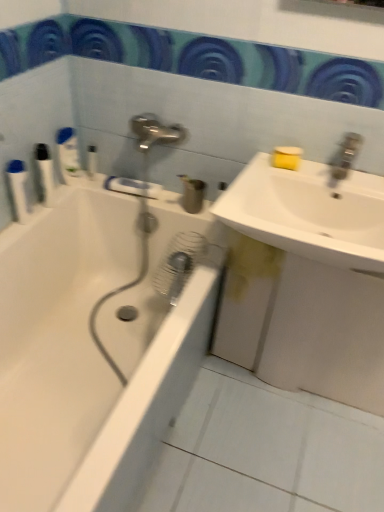
Question: Should I look upward or downward to see white glossy sink at upper right, placed as the first sink when sorted from top to bottom?

Choices:
 (A) up
 (B) down

Answer: (A)

Question: Is white plastic bottle at upper left, acting as the 3th toiletry starting from the right, aimed at white glossy bathtub at left?

Choices:
 (A) yes
 (B) no

Answer: (B)

Question: From a real-world perspective, is white plastic bottle at upper left, acting as the 3th toiletry starting from the right, on top of white glossy bathtub at left?

Choices:
 (A) yes
 (B) no

Answer: (A)

Question: Can you confirm if white plastic bottle at upper left, the third toiletry when ordered from left to right, is wider than white glossy bathtub at left?

Choices:
 (A) yes
 (B) no

Answer: (B)

Question: Is white plastic bottle at upper left, the third toiletry when ordered from left to right, completely or partially outside of white glossy bathtub at left?

Choices:
 (A) yes
 (B) no

Answer: (A)

Question: From the image's perspective, is white plastic bottle at upper left, acting as the 3th toiletry starting from the right, located above white glossy bathtub at left?

Choices:
 (A) yes
 (B) no

Answer: (A)

Question: Does white plastic bottle at upper left, acting as the 3th toiletry starting from the right, have a larger size compared to white glossy bathtub at left?

Choices:
 (A) yes
 (B) no

Answer: (B)

Question: Considering the relative sizes of white ceramic tile at lower center and white plastic bottle at upper left, acting as the 3th toiletry starting from the right, in the image provided, is white ceramic tile at lower center shorter than white plastic bottle at upper left, acting as the 3th toiletry starting from the right,?

Choices:
 (A) yes
 (B) no

Answer: (A)

Question: Is white ceramic tile at lower center at the right side of white plastic bottle at upper left, the third toiletry when ordered from left to right?

Choices:
 (A) no
 (B) yes

Answer: (B)

Question: From a real-world perspective, does white ceramic tile at lower center sit lower than white plastic bottle at upper left, the third toiletry when ordered from left to right?

Choices:
 (A) yes
 (B) no

Answer: (A)

Question: Considering the relative sizes of white ceramic tile at lower center and white plastic bottle at upper left, the third toiletry when ordered from left to right, in the image provided, is white ceramic tile at lower center taller than white plastic bottle at upper left, the third toiletry when ordered from left to right,?

Choices:
 (A) no
 (B) yes

Answer: (A)

Question: Considering the relative positions of white ceramic tile at lower center and white plastic bottle at upper left, acting as the 3th toiletry starting from the right, in the image provided, is white ceramic tile at lower center to the left of white plastic bottle at upper left, acting as the 3th toiletry starting from the right, from the viewer's perspective?

Choices:
 (A) yes
 (B) no

Answer: (B)

Question: Would you consider white ceramic tile at lower center to be distant from white plastic bottle at upper left, acting as the 3th toiletry starting from the right?

Choices:
 (A) yes
 (B) no

Answer: (A)

Question: Is white plastic bottle at upper left, acting as the 3th toiletry starting from the right, closer to the viewer compared to white ceramic tile at lower center?

Choices:
 (A) no
 (B) yes

Answer: (A)